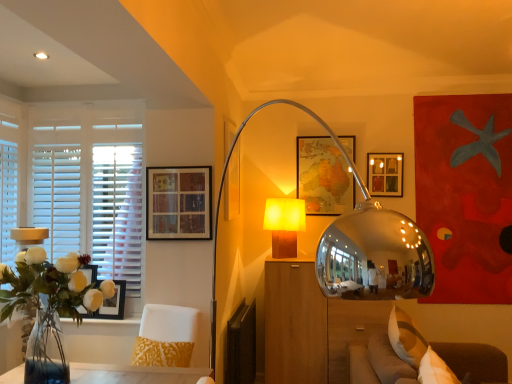
What is the approximate height of matte black picture frame at upper center, which appears as the third picture frame when viewed from the right?

The height of matte black picture frame at upper center, which appears as the third picture frame when viewed from the right, is 30.16 inches.

The width and height of the screenshot is (512, 384). I want to click on matte black picture frame at upper center, marked as the third picture frame in a back-to-front arrangement, so [232, 185].

Consider the image. Measure the distance between wooden block lamp at center and camera.

The depth of wooden block lamp at center is 3.46 meters.

The image size is (512, 384). What do you see at coordinates (406, 338) in the screenshot? I see `white fabric pillow at lower right` at bounding box center [406, 338].

This screenshot has width=512, height=384. Identify the location of matte black picture frame at left, the 1th picture frame from the left. (109, 304).

The width and height of the screenshot is (512, 384). In order to click on matte wooden picture frame at upper left, arranged as the fifth picture frame when viewed from the back in this screenshot , I will do `click(179, 203)`.

What do you see at coordinates (179, 203) in the screenshot? This screenshot has height=384, width=512. I see `matte wooden picture frame at upper left, arranged as the fifth picture frame when viewed from the back` at bounding box center [179, 203].

Where is `white fabric swivel chair at lower left`? The image size is (512, 384). white fabric swivel chair at lower left is located at coordinates (165, 336).

From the image's perspective, which one is positioned lower, matte black picture frame at upper center, acting as the 3th picture frame starting from the front, or matte black picture frame at left, placed as the 2th picture frame when sorted from front to back?

matte black picture frame at left, placed as the 2th picture frame when sorted from front to back, appears lower in the image.

Is matte black picture frame at upper center, acting as the 3th picture frame starting from the front, behind matte black picture frame at left, placed as the 2th picture frame when sorted from front to back?

Yes.

The height and width of the screenshot is (384, 512). I want to click on the 4th picture frame positioned above the matte black picture frame at left, the 1th picture frame from the left (from the image's perspective), so click(x=232, y=185).

Consider the image. How many degrees apart are the facing directions of matte black picture frame at upper center, acting as the 3th picture frame starting from the front, and matte black picture frame at left, the 1th picture frame from the left?

The angle between the facing direction of matte black picture frame at upper center, acting as the 3th picture frame starting from the front, and the facing direction of matte black picture frame at left, the 1th picture frame from the left, is 89.9 degrees.

Would you say matte wooden picture frame at upper right, marked as the fourth picture frame in a front-to-back arrangement, is a long distance from matte wooden picture frame at upper left, the fourth picture frame from the right?

matte wooden picture frame at upper right, marked as the fourth picture frame in a front-to-back arrangement, is far away from matte wooden picture frame at upper left, the fourth picture frame from the right.

Does matte wooden picture frame at upper right, marked as the fourth picture frame in a front-to-back arrangement, have a greater width compared to matte wooden picture frame at upper left, the fourth picture frame from the right?

Correct, the width of matte wooden picture frame at upper right, marked as the fourth picture frame in a front-to-back arrangement, exceeds that of matte wooden picture frame at upper left, the fourth picture frame from the right.

Which of these two, matte wooden picture frame at upper right, arranged as the 2th picture frame when viewed from the back, or matte wooden picture frame at upper left, arranged as the fifth picture frame when viewed from the back, stands shorter?

matte wooden picture frame at upper right, arranged as the 2th picture frame when viewed from the back.

How many degrees apart are the facing directions of soft beige fabric couch at lower right and white fabric pillow at lower right?

soft beige fabric couch at lower right and white fabric pillow at lower right are facing 13.3 degrees away from each other.

In the image, is soft beige fabric couch at lower right on the left side or the right side of white fabric pillow at lower right?

Clearly, soft beige fabric couch at lower right is on the right of white fabric pillow at lower right in the image.

Which object is wider, soft beige fabric couch at lower right or white fabric pillow at lower right?

soft beige fabric couch at lower right is wider.

Is soft beige fabric couch at lower right located outside white fabric pillow at lower right?

Yes.

From the picture: Is wooden block lamp at center looking in the opposite direction of white fabric swivel chair at lower left?

No, wooden block lamp at center's orientation is not away from white fabric swivel chair at lower left.

From a real-world perspective, relative to white fabric swivel chair at lower left, is wooden block lamp at center vertically above or below?

Clearly, from a real-world perspective, wooden block lamp at center is above white fabric swivel chair at lower left.

Is there a large distance between wooden block lamp at center and white fabric swivel chair at lower left?

That's right, there is a large distance between wooden block lamp at center and white fabric swivel chair at lower left.

Does point (293, 218) come closer to viewer compared to point (174, 352)?

No, (293, 218) is behind (174, 352).

Who is bigger, white fabric swivel chair at lower left or soft beige fabric couch at lower right?

soft beige fabric couch at lower right.

Is white fabric swivel chair at lower left oriented away from soft beige fabric couch at lower right?

No, white fabric swivel chair at lower left's orientation is not away from soft beige fabric couch at lower right.

Which is in front, white fabric swivel chair at lower left or soft beige fabric couch at lower right?

soft beige fabric couch at lower right is closer to the camera.

Does point (25, 147) come behind point (117, 316)?

Yes, point (25, 147) is farther from viewer.

Can you tell me how much white wooden blinds at left and matte black picture frame at left, placed as the 2th picture frame when sorted from front to back, differ in facing direction?

white wooden blinds at left and matte black picture frame at left, placed as the 2th picture frame when sorted from front to back, are facing 0.939 degrees away from each other.

Does white wooden blinds at left have a greater height compared to matte black picture frame at left, placed as the 2th picture frame when sorted from front to back?

Correct, white wooden blinds at left is much taller as matte black picture frame at left, placed as the 2th picture frame when sorted from front to back.

There is a white fabric pillow at lower right. Identify the location of the 2nd picture frame above it (from the image's perspective). This screenshot has height=384, width=512. (179, 203).

Could you tell me if matte wooden picture frame at upper left, the 1th picture frame positioned from the front, is facing white fabric pillow at lower right?

No, matte wooden picture frame at upper left, the 1th picture frame positioned from the front, is not oriented towards white fabric pillow at lower right.

Is point (208, 193) closer or farther from the camera than point (409, 331)?

Point (208, 193) appears to be farther away from the viewer than point (409, 331).

Choose the correct answer: Is matte wooden picture frame at upper left, the fourth picture frame from the right, inside white fabric pillow at lower right or outside it?

matte wooden picture frame at upper left, the fourth picture frame from the right, cannot be found inside white fabric pillow at lower right.

I want to click on picture frame that is the 2nd object above the matte black picture frame at left, the fifth picture frame positioned from the right (from a real-world perspective), so click(x=232, y=185).

Locate an element on the screen. the 3rd picture frame in front of the matte wooden picture frame at upper right, arranged as the 2th picture frame when viewed from the back, counting from the anchor's position is located at coordinates (179, 203).

Estimate the real-world distances between objects in this image. Which object is closer to wooden block lamp at center, matte black picture frame at upper center, marked as the third picture frame in a back-to-front arrangement, or clear glass vase at left?

matte black picture frame at upper center, marked as the third picture frame in a back-to-front arrangement, is closer to wooden block lamp at center.

Which object lies further to the anchor point wooden block lamp at center, matte wooden picture frame at upper left, which appears as the second picture frame when viewed from the left, or white fabric swivel chair at lower left?

white fabric swivel chair at lower left lies further to wooden block lamp at center than the other object.

From the image, which object appears to be nearer to matte black picture frame at upper center, acting as the 3th picture frame starting from the front, wooden block lamp at center or soft beige fabric couch at lower right?

The object closer to matte black picture frame at upper center, acting as the 3th picture frame starting from the front, is wooden block lamp at center.

Based on the photo, considering their positions, is soft beige fabric couch at lower right positioned further to matte wooden picture frame at center, the 2th picture frame in the right-to-left sequence, than wooden block lamp at center?

soft beige fabric couch at lower right is further to matte wooden picture frame at center, the 2th picture frame in the right-to-left sequence.

Looking at the image, which one is located closer to white fabric pillow at lower right, white fabric swivel chair at lower left or matte wooden picture frame at upper right, which is the fifth picture frame from left to right?

white fabric swivel chair at lower left is closer to white fabric pillow at lower right.

When comparing their distances from clear glass vase at left, does wooden block lamp at center or matte wooden picture frame at upper right, which ranks as the first picture frame in right-to-left order, seem further?

matte wooden picture frame at upper right, which ranks as the first picture frame in right-to-left order.

Based on their spatial positions, is matte wooden picture frame at center, the fifth picture frame when ordered from front to back, or white fabric swivel chair at lower left closer to clear glass vase at left?

Based on the image, white fabric swivel chair at lower left appears to be nearer to clear glass vase at left.

When comparing their distances from matte black picture frame at upper center, which is the third picture frame from left to right, does soft beige fabric couch at lower right or wooden dresser at center seem closer?

wooden dresser at center is positioned closer to the anchor matte black picture frame at upper center, which is the third picture frame from left to right.

Where is `dresser located between matte wooden picture frame at upper left, arranged as the fifth picture frame when viewed from the back, and soft beige fabric couch at lower right in the left-right direction`? This screenshot has height=384, width=512. dresser located between matte wooden picture frame at upper left, arranged as the fifth picture frame when viewed from the back, and soft beige fabric couch at lower right in the left-right direction is located at coordinates 312,325.

At what (x,y) coordinates should I click in order to perform the action: click on picture frame between matte black picture frame at upper center, which appears as the third picture frame when viewed from the right, and matte wooden picture frame at upper right, which is the fifth picture frame from left to right, from left to right. Please return your answer as a coordinate pair (x, y). Looking at the image, I should click on (323, 177).

This screenshot has width=512, height=384. Identify the location of pillow between white fabric swivel chair at lower left and matte wooden picture frame at upper right, which is the fifth picture frame from left to right, from left to right. (406, 338).

This screenshot has width=512, height=384. I want to click on dresser situated between matte black picture frame at left, placed as the 2th picture frame when sorted from front to back, and soft beige fabric couch at lower right from left to right, so click(312, 325).